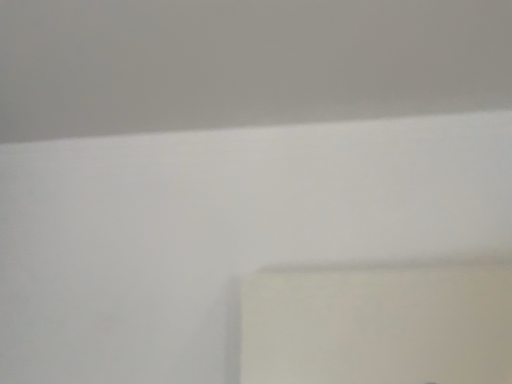
Measure the distance between point (x=493, y=42) and camera.

Point (x=493, y=42) is 94.30 centimeters away from camera.

Describe the element at coordinates (244, 62) in the screenshot. I see `white matte wall at upper center` at that location.

Where is `white matte wall at upper center`? white matte wall at upper center is located at coordinates (244, 62).

At what (x,y) coordinates should I click in order to perform the action: click on white matte wall at upper center. Please return your answer as a coordinate pair (x, y). Looking at the image, I should click on (244, 62).